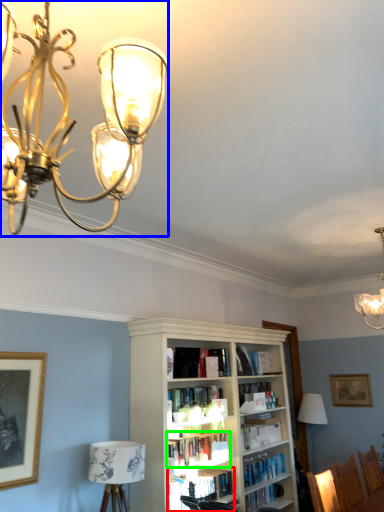
Question: Estimate the real-world distances between objects in this image. Which object is farther from book (highlighted by a red box), lamp (highlighted by a blue box) or book (highlighted by a green box)?

Choices:
 (A) lamp
 (B) book

Answer: (A)